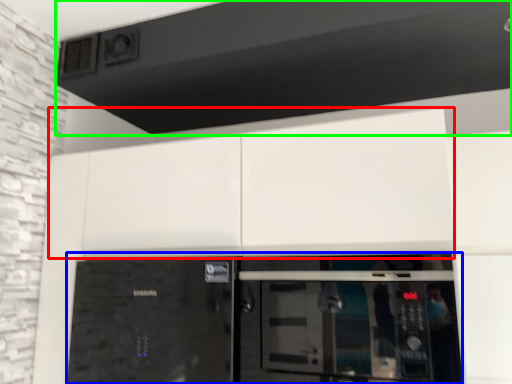
Question: Considering the real-world distances, which object is farthest from cabinetry (highlighted by a red box)? home appliance (highlighted by a blue box) or exhaust hood (highlighted by a green box)?

Choices:
 (A) home appliance
 (B) exhaust hood

Answer: (B)